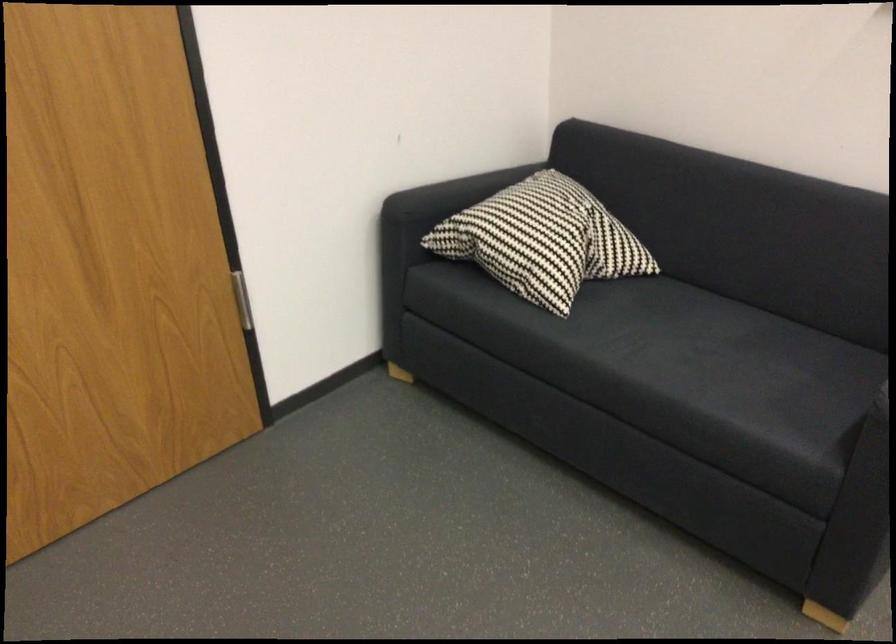
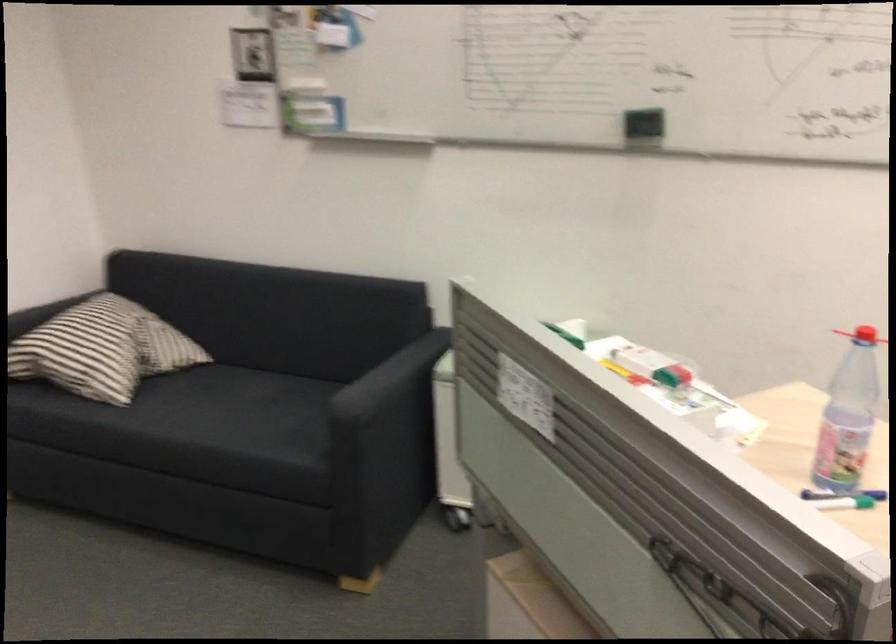
Based on the photo, which direction would the cameraman need to move to produce the second image?

The movement direction of the cameraman is right, backward.